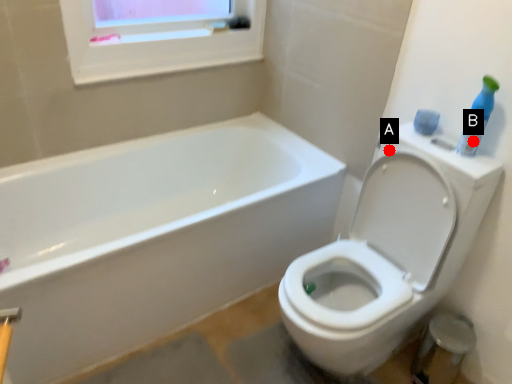
Question: Two points are circled on the image, labeled by A and B beside each circle. Which of the following is the farthest from the observer?

Choices:
 (A) A is further
 (B) B is further

Answer: (A)